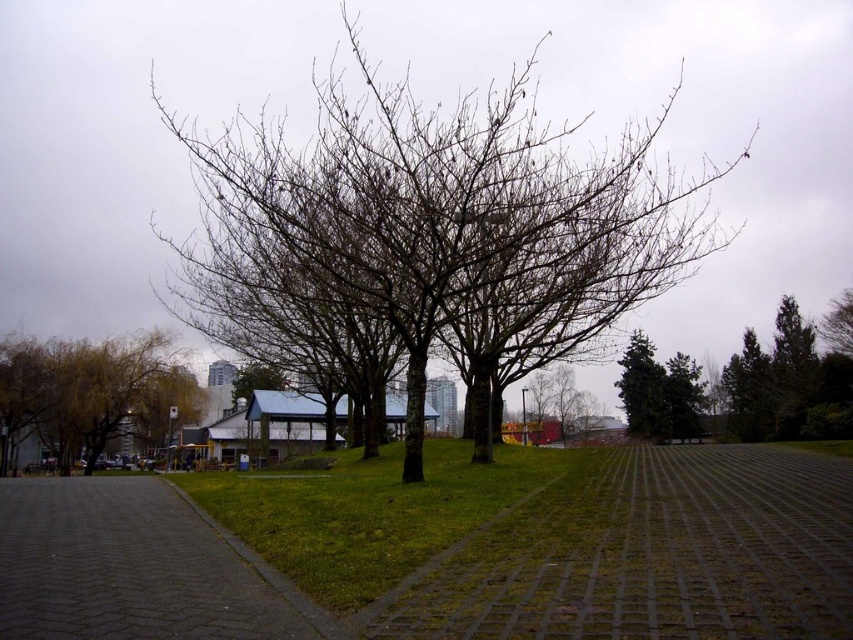
From the picture: You are a bird looking for a nesting spot. You see the bare branches at center and the green leafy tree at left. Which tree would be a better choice for nesting based on their height?

The bare branches at center is taller than the green leafy tree at left, so it would be a better choice for nesting as it offers a higher vantage point.

You are a gardener trying to water the green leafy tree at left. You notice the gray concrete path at center is covering part of its roots. Can you determine if the tree is in danger of root damage due to the path?

The gray concrete path at center is positioned over green leafy tree at left, which means the path is covering part of the tree roots. This could restrict root growth and access to water, potentially causing root damage over time.